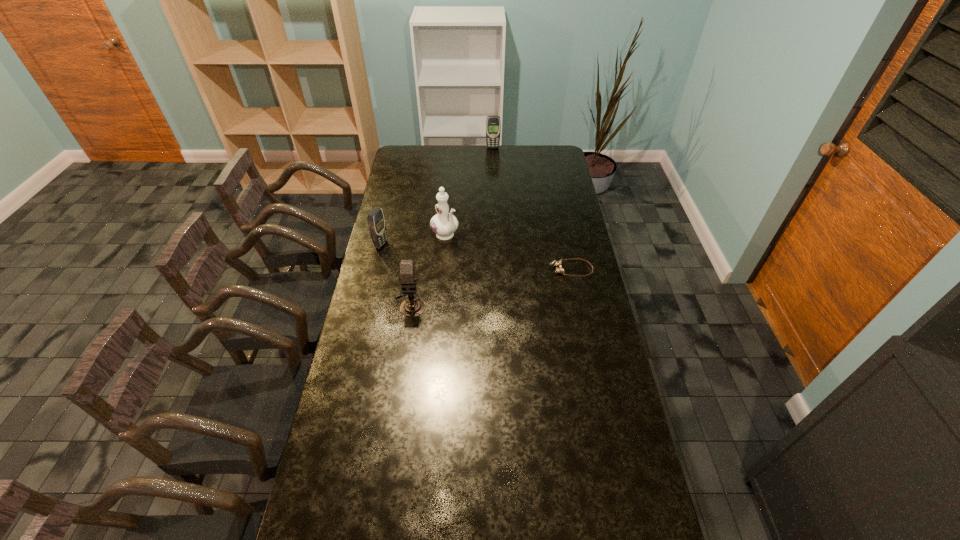
Image resolution: width=960 pixels, height=540 pixels. Find the location of `empty location between the farthest object and the chinaware`. empty location between the farthest object and the chinaware is located at coordinates (468, 192).

At what (x,y) coordinates should I click in order to perform the action: click on vacant space that's between the farthest object and the chinaware. Please return your answer as a coordinate pair (x, y). This screenshot has width=960, height=540. Looking at the image, I should click on (468, 192).

The height and width of the screenshot is (540, 960). Find the location of `empty space between the chinaware and the nearest object`. empty space between the chinaware and the nearest object is located at coordinates (427, 270).

In order to click on vacant area between the microphone and the left cellular telephone in this screenshot , I will do `click(396, 274)`.

Locate an element on the screen. free spot between the left cellular telephone and the chinaware is located at coordinates coord(413,240).

Find the location of a particular element. This screenshot has height=540, width=960. free point between the rightmost object and the second object from right to left is located at coordinates (532, 208).

You are a GUI agent. You are given a task and a screenshot of the screen. Output one action in this format:
    pyautogui.click(x=<x>, y=<y>)
    Task: Click on the vacant region between the chinaware and the shortest object
    
    Given the screenshot: What is the action you would take?
    pyautogui.click(x=508, y=253)

Locate an element on the screen. Image resolution: width=960 pixels, height=540 pixels. free space between the microphone and the chinaware is located at coordinates (427, 270).

Find the location of a particular element. This screenshot has width=960, height=540. object that can be found as the second closest to the left cellular telephone is located at coordinates (411, 307).

This screenshot has height=540, width=960. I want to click on object that is the third nearest to the rightmost object, so click(x=376, y=222).